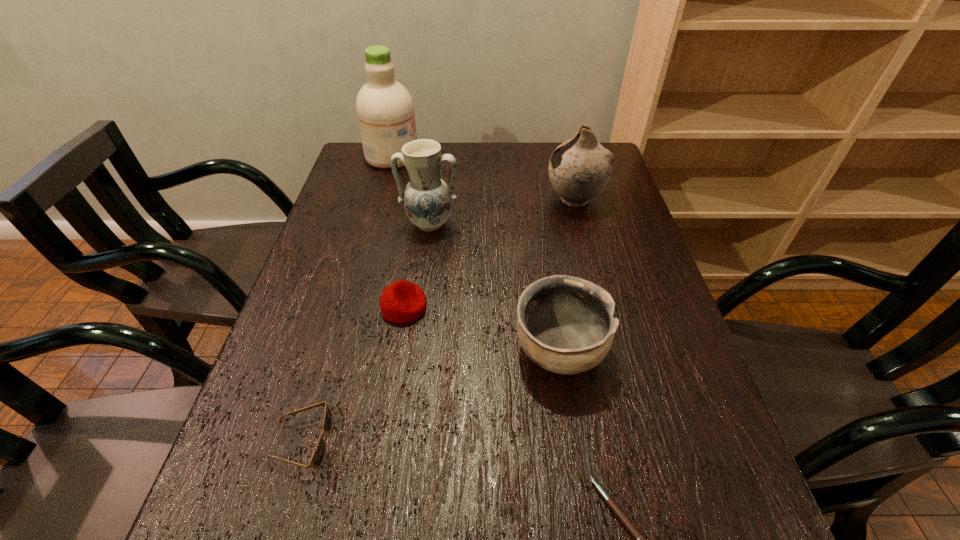
You are a GUI agent. You are given a task and a screenshot of the screen. Output one action in this format:
    pyautogui.click(x=<x>, y=<y>)
    Task: Click on the cleansing agent
    
    Given the screenshot: What is the action you would take?
    pyautogui.click(x=385, y=110)

What are the coordinates of `the farthest object` in the screenshot? It's located at (385, 110).

Find the location of a particular element. The height and width of the screenshot is (540, 960). the leftmost pottery is located at coordinates (427, 199).

The width and height of the screenshot is (960, 540). Identify the location of the fourth tallest object. (565, 324).

What are the coordinates of `the nearest pottery` in the screenshot? It's located at (565, 324).

Where is `the fifth tallest object`? Image resolution: width=960 pixels, height=540 pixels. the fifth tallest object is located at coordinates (402, 301).

I want to click on the sixth farthest object, so click(x=318, y=456).

The height and width of the screenshot is (540, 960). Find the location of `the second shortest object`. the second shortest object is located at coordinates (318, 456).

This screenshot has width=960, height=540. In order to click on free spot located 0.340m on the front label of the tallest object in this screenshot , I will do `click(522, 156)`.

Where is `vacant space located 0.400m on either side of the leftmost pottery`? vacant space located 0.400m on either side of the leftmost pottery is located at coordinates (411, 369).